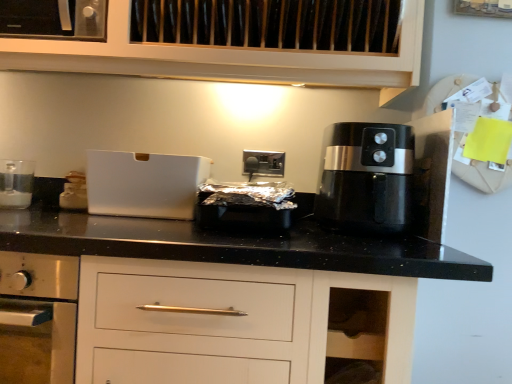
Describe the element at coordinates (263, 163) in the screenshot. The height and width of the screenshot is (384, 512). I see `satin silver outlet at center` at that location.

Image resolution: width=512 pixels, height=384 pixels. Find the location of `satin silver outlet at center`. satin silver outlet at center is located at coordinates (263, 163).

In order to click on white matte bread box at left, which is the 2th kitchen appliance in left-to-right order in this screenshot , I will do `click(74, 192)`.

This screenshot has width=512, height=384. Identify the location of black plastic air fryer at right. (367, 178).

What do you see at coordinates (367, 178) in the screenshot? This screenshot has height=384, width=512. I see `black plastic air fryer at right` at bounding box center [367, 178].

Image resolution: width=512 pixels, height=384 pixels. I want to click on satin silver outlet at center, so click(263, 163).

Which is behind, point (0, 205) or point (354, 129)?

The point (0, 205) is farther.

This screenshot has height=384, width=512. I want to click on the 2nd kitchen appliance to the left of the black plastic air fryer at right, starting your count from the anchor, so click(16, 183).

In terms of height, does clear glass at left, which is counted as the first kitchen appliance, starting from the left, look taller or shorter compared to black plastic air fryer at right?

Considering their sizes, clear glass at left, which is counted as the first kitchen appliance, starting from the left, has less height than black plastic air fryer at right.

Does clear glass at left, arranged as the second kitchen appliance when viewed from the right, appear on the left side of black plastic air fryer at right?

Correct, you'll find clear glass at left, arranged as the second kitchen appliance when viewed from the right, to the left of black plastic air fryer at right.

In the scene shown: From a real-world perspective, is clear glass at left, which is counted as the first kitchen appliance, starting from the left, physically located above or below white matte box at center?

Clearly, from a real-world perspective, clear glass at left, which is counted as the first kitchen appliance, starting from the left, is below white matte box at center.

Does clear glass at left, which is counted as the first kitchen appliance, starting from the left, have a larger size compared to white matte box at center?

No.

The height and width of the screenshot is (384, 512). In order to click on the 1st kitchen appliance behind the white matte box at center in this screenshot , I will do `click(16, 183)`.

Would you say clear glass at left, which is counted as the first kitchen appliance, starting from the left, contains white matte box at center?

No, white matte box at center is not a part of clear glass at left, which is counted as the first kitchen appliance, starting from the left.

Is white matte bread box at left, acting as the 1th kitchen appliance starting from the right, placed right next to clear glass at left, arranged as the second kitchen appliance when viewed from the right?

white matte bread box at left, acting as the 1th kitchen appliance starting from the right, and clear glass at left, arranged as the second kitchen appliance when viewed from the right, are not in contact.

Where is `kitchen appliance that is behind the clear glass at left, arranged as the second kitchen appliance when viewed from the right`? The height and width of the screenshot is (384, 512). kitchen appliance that is behind the clear glass at left, arranged as the second kitchen appliance when viewed from the right is located at coordinates (74, 192).

Can you confirm if white matte bread box at left, which is the 2th kitchen appliance in left-to-right order, is smaller than clear glass at left, arranged as the second kitchen appliance when viewed from the right?

Yes.

Considering the relative sizes of white matte box at center and white matte bread box at left, which is the 2th kitchen appliance in left-to-right order, in the image provided, is white matte box at center thinner than white matte bread box at left, which is the 2th kitchen appliance in left-to-right order,?

In fact, white matte box at center might be wider than white matte bread box at left, which is the 2th kitchen appliance in left-to-right order.

Does white matte box at center come behind white matte bread box at left, which is the 2th kitchen appliance in left-to-right order?

No.

Identify the location of kitchen appliance that is below the white matte box at center (from the image's perspective). The height and width of the screenshot is (384, 512). (74, 192).

Is white matte box at center not near white matte bread box at left, acting as the 1th kitchen appliance starting from the right?

They are positioned close to each other.

From a real-world perspective, is satin silver outlet at center on top of white matte bread box at left, which is the 2th kitchen appliance in left-to-right order?

Yes, from a real-world perspective, satin silver outlet at center is over white matte bread box at left, which is the 2th kitchen appliance in left-to-right order

Is satin silver outlet at center oriented away from white matte bread box at left, which is the 2th kitchen appliance in left-to-right order?

No, satin silver outlet at center is not facing the opposite direction of white matte bread box at left, which is the 2th kitchen appliance in left-to-right order.

Considering the points (260, 170) and (72, 207), which point is behind, point (260, 170) or point (72, 207)?

Point (260, 170)

How far apart are satin silver outlet at center and white matte bread box at left, which is the 2th kitchen appliance in left-to-right order?

The distance of satin silver outlet at center from white matte bread box at left, which is the 2th kitchen appliance in left-to-right order, is 23.07 inches.

Is clear glass at left, which is counted as the first kitchen appliance, starting from the left, looking in the opposite direction of white matte bread box at left, which is the 2th kitchen appliance in left-to-right order?

clear glass at left, which is counted as the first kitchen appliance, starting from the left, is not turned away from white matte bread box at left, which is the 2th kitchen appliance in left-to-right order.

Considering the positions of objects clear glass at left, which is counted as the first kitchen appliance, starting from the left, and white matte bread box at left, which is the 2th kitchen appliance in left-to-right order, in the image provided, who is behind, clear glass at left, which is counted as the first kitchen appliance, starting from the left, or white matte bread box at left, which is the 2th kitchen appliance in left-to-right order,?

white matte bread box at left, which is the 2th kitchen appliance in left-to-right order.

Considering the relative sizes of clear glass at left, arranged as the second kitchen appliance when viewed from the right, and white matte bread box at left, which is the 2th kitchen appliance in left-to-right order, in the image provided, is clear glass at left, arranged as the second kitchen appliance when viewed from the right, taller than white matte bread box at left, which is the 2th kitchen appliance in left-to-right order,?

Yes.

Does point (22, 204) lie in front of point (81, 201)?

Yes, it is in front of point (81, 201).

Which of these two, white matte box at center or clear glass at left, arranged as the second kitchen appliance when viewed from the right, is smaller?

Smaller between the two is clear glass at left, arranged as the second kitchen appliance when viewed from the right.

Is point (112, 202) positioned behind point (3, 164)?

No, it is not.

Does white matte box at center appear on the right side of clear glass at left, arranged as the second kitchen appliance when viewed from the right?

Indeed, white matte box at center is positioned on the right side of clear glass at left, arranged as the second kitchen appliance when viewed from the right.

Is white matte box at center further to camera compared to clear glass at left, which is counted as the first kitchen appliance, starting from the left?

That is False.

Locate an element on the screen. coffee machine above the clear glass at left, arranged as the second kitchen appliance when viewed from the right (from the image's perspective) is located at coordinates (367, 178).

From the white matte box at center, count 1st kitchen appliances backward and point to it. Please provide its 2D coordinates.

[(16, 183)]

Which object lies nearer to the anchor point white matte bread box at left, acting as the 1th kitchen appliance starting from the right, black plastic air fryer at right or clear glass at left, arranged as the second kitchen appliance when viewed from the right?

clear glass at left, arranged as the second kitchen appliance when viewed from the right, is positioned closer to the anchor white matte bread box at left, acting as the 1th kitchen appliance starting from the right.

Consider the image. From the image, which object appears to be nearer to satin silver outlet at center, black plastic air fryer at right or white matte box at center?

Among the two, white matte box at center is located nearer to satin silver outlet at center.

When comparing their distances from white matte bread box at left, acting as the 1th kitchen appliance starting from the right, does clear glass at left, arranged as the second kitchen appliance when viewed from the right, or satin silver outlet at center seem closer?

clear glass at left, arranged as the second kitchen appliance when viewed from the right, is closer to white matte bread box at left, acting as the 1th kitchen appliance starting from the right.

From the image, which object appears to be nearer to black plastic air fryer at right, clear glass at left, arranged as the second kitchen appliance when viewed from the right, or white matte box at center?

white matte box at center is positioned closer to the anchor black plastic air fryer at right.

Based on their spatial positions, is white matte bread box at left, which is the 2th kitchen appliance in left-to-right order, or black plastic air fryer at right closer to clear glass at left, which is counted as the first kitchen appliance, starting from the left?

Among the two, white matte bread box at left, which is the 2th kitchen appliance in left-to-right order, is located nearer to clear glass at left, which is counted as the first kitchen appliance, starting from the left.

From the image, which object appears to be farther from clear glass at left, arranged as the second kitchen appliance when viewed from the right, black plastic air fryer at right or satin silver outlet at center?

black plastic air fryer at right lies further to clear glass at left, arranged as the second kitchen appliance when viewed from the right, than the other object.

Consider the image. Looking at the image, which one is located further to black plastic air fryer at right, white matte box at center or white matte bread box at left, acting as the 1th kitchen appliance starting from the right?

white matte bread box at left, acting as the 1th kitchen appliance starting from the right, lies further to black plastic air fryer at right than the other object.

Considering their positions, is black plastic air fryer at right positioned further to white matte bread box at left, acting as the 1th kitchen appliance starting from the right, than satin silver outlet at center?

black plastic air fryer at right lies further to white matte bread box at left, acting as the 1th kitchen appliance starting from the right, than the other object.

The image size is (512, 384). Identify the location of appliance between white matte bread box at left, which is the 2th kitchen appliance in left-to-right order, and satin silver outlet at center, in the horizontal direction. (144, 184).

What are the coordinates of `kitchen appliance between clear glass at left, arranged as the second kitchen appliance when viewed from the right, and white matte box at center, in the horizontal direction` in the screenshot? It's located at coord(74,192).

Where is `appliance situated between white matte bread box at left, acting as the 1th kitchen appliance starting from the right, and black plastic air fryer at right from left to right`? appliance situated between white matte bread box at left, acting as the 1th kitchen appliance starting from the right, and black plastic air fryer at right from left to right is located at coordinates tap(144, 184).

The height and width of the screenshot is (384, 512). Find the location of `electric outlet between clear glass at left, arranged as the second kitchen appliance when viewed from the right, and black plastic air fryer at right, in the horizontal direction`. electric outlet between clear glass at left, arranged as the second kitchen appliance when viewed from the right, and black plastic air fryer at right, in the horizontal direction is located at coordinates (263, 163).